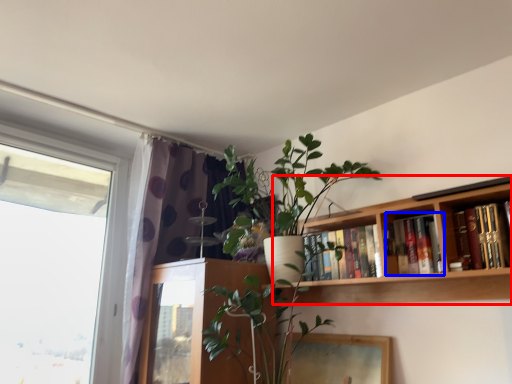
Question: Which object is closer to the camera taking this photo, bookcase (highlighted by a red box) or book (highlighted by a blue box)?

Choices:
 (A) bookcase
 (B) book

Answer: (A)